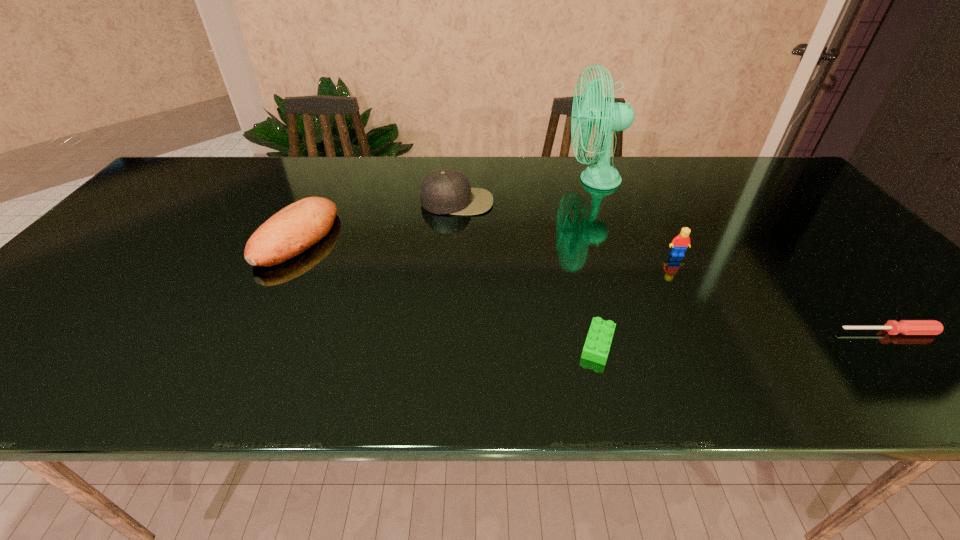
Find the location of a particular element. The height and width of the screenshot is (540, 960). free space located in front of the tallest object to blow air is located at coordinates (469, 180).

At what (x,y) coordinates should I click in order to perform the action: click on free point located in front of the tallest object to blow air. Please return your answer as a coordinate pair (x, y). The height and width of the screenshot is (540, 960). Looking at the image, I should click on (492, 180).

Where is `vacant point located in front of the tallest object to blow air`? This screenshot has width=960, height=540. vacant point located in front of the tallest object to blow air is located at coordinates (469, 180).

Find the location of a particular element. The image size is (960, 540). vacant space positioned on the brim of the fifth object from right to left is located at coordinates tap(451, 275).

Locate an element on the screen. The height and width of the screenshot is (540, 960). vacant area located 0.330m on the face of the farther Lego is located at coordinates (734, 365).

Locate an element on the screen. Image resolution: width=960 pixels, height=540 pixels. free space located on the left of the leftmost object is located at coordinates (150, 238).

Locate an element on the screen. free spot located on the back of the nearer Lego is located at coordinates (573, 246).

This screenshot has height=540, width=960. Identify the location of free location located 0.160m on the left of the rightmost object. (763, 332).

The width and height of the screenshot is (960, 540). Find the location of `fan that is at the far edge`. fan that is at the far edge is located at coordinates (610, 117).

Find the location of a particular element. Image resolution: width=960 pixels, height=540 pixels. cap that is at the far edge is located at coordinates (444, 191).